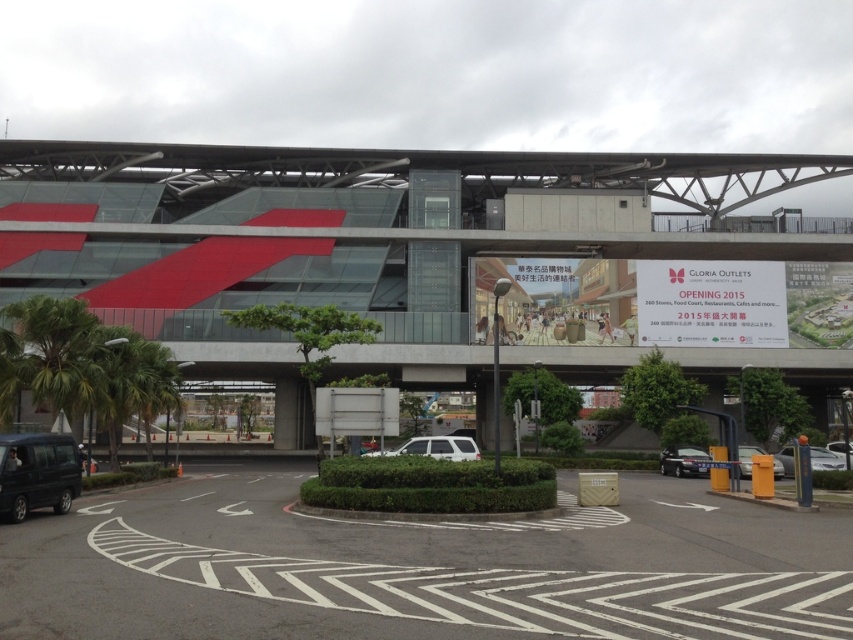
Question: Is shiny black sedan at lower right above silver metallic sedan at lower right?

Choices:
 (A) yes
 (B) no

Answer: (B)

Question: Where is red glass building at center located in relation to matte black van at lower left in the image?

Choices:
 (A) left
 (B) right

Answer: (B)

Question: Which of the following is the farthest from the observer?

Choices:
 (A) (842, 454)
 (B) (438, 458)
 (C) (747, 472)
 (D) (834, 458)

Answer: (A)

Question: Which of the following is the farthest from the observer?

Choices:
 (A) silver metallic car at center
 (B) shiny black sedan at lower right

Answer: (B)

Question: In this image, where is red glass building at center located relative to silver metallic car at center?

Choices:
 (A) left
 (B) right

Answer: (A)

Question: Which point is closer to the camera?

Choices:
 (A) (434, 454)
 (B) (50, 465)
 (C) (674, 454)
 (D) (850, 460)

Answer: (B)